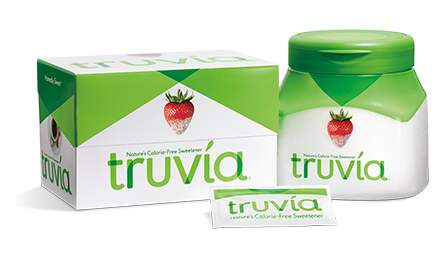
Find the location of a particular element. Image resolution: width=445 pixels, height=258 pixels. mug is located at coordinates (53, 136).